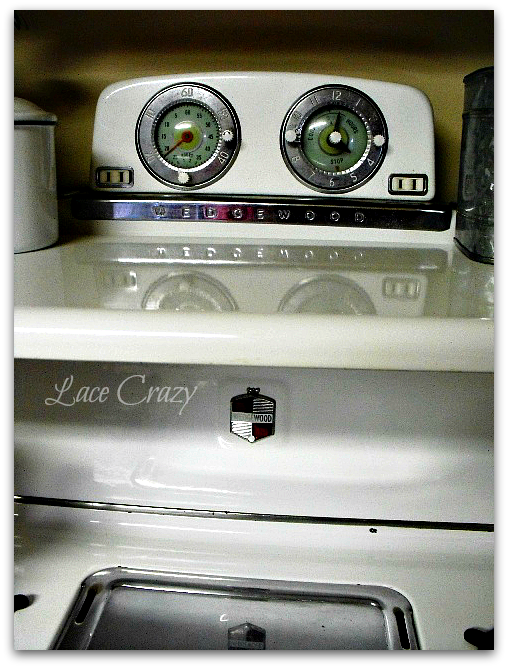
Image resolution: width=508 pixels, height=668 pixels. Identify the location of white pot. (29, 170).